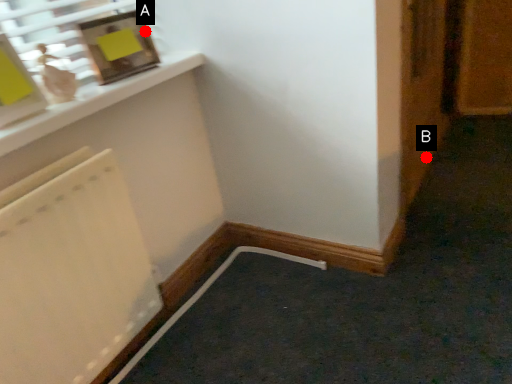
Question: Two points are circled on the image, labeled by A and B beside each circle. Which point appears closest to the camera in this image?

Choices:
 (A) A is closer
 (B) B is closer

Answer: (A)